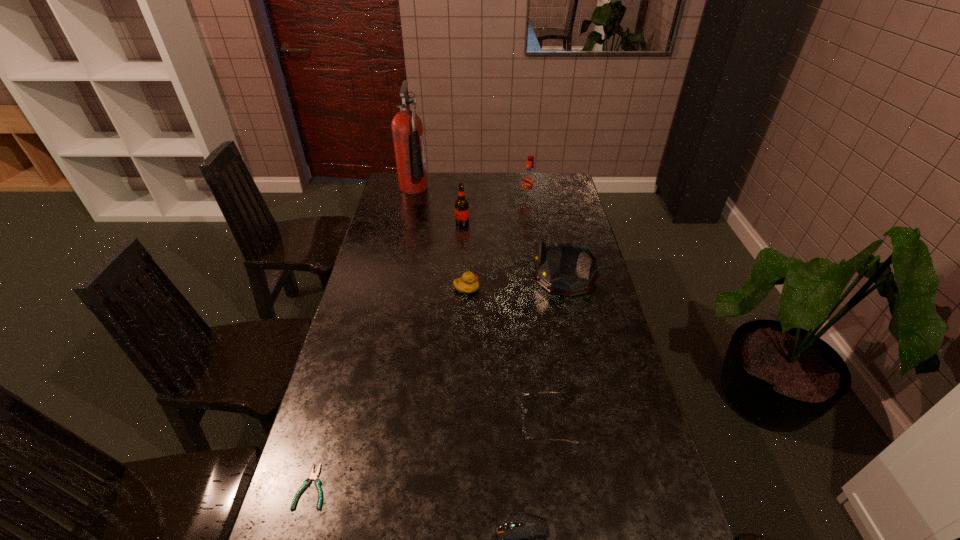
You are a GUI agent. You are given a task and a screenshot of the screen. Output one action in this format:
    pyautogui.click(x=<x>, y=<y>)
    Task: Click on the free spot that satisfies the following two spatial constraints: 1. on the back side of the left root beer; 2. on the right side of the right root beer
    
    Given the screenshot: What is the action you would take?
    pyautogui.click(x=464, y=200)

Find the location of `free location that satisfies the following two spatial constraints: 1. on the front of the right root beer near the operation label; 2. on the left side of the tallest object`. free location that satisfies the following two spatial constraints: 1. on the front of the right root beer near the operation label; 2. on the left side of the tallest object is located at coordinates (411, 200).